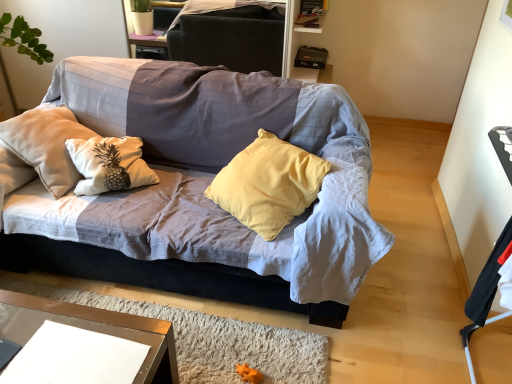
Question: Is black fabric armchair at right not close to dark gray fabric dresser at upper center?

Choices:
 (A) no
 (B) yes

Answer: (B)

Question: Is dark gray fabric dresser at upper center a part of black fabric armchair at right?

Choices:
 (A) no
 (B) yes

Answer: (A)

Question: Is black fabric armchair at right next to dark gray fabric dresser at upper center?

Choices:
 (A) no
 (B) yes

Answer: (A)

Question: From a real-world perspective, is black fabric armchair at right over dark gray fabric dresser at upper center?

Choices:
 (A) no
 (B) yes

Answer: (A)

Question: Is black fabric armchair at right wider than dark gray fabric dresser at upper center?

Choices:
 (A) yes
 (B) no

Answer: (A)

Question: Is black fabric armchair at right oriented away from dark gray fabric dresser at upper center?

Choices:
 (A) no
 (B) yes

Answer: (A)

Question: Could you tell me if textured fabric couch at center is turned towards dark gray fabric dresser at upper center?

Choices:
 (A) yes
 (B) no

Answer: (B)

Question: Is textured fabric couch at center taller than dark gray fabric dresser at upper center?

Choices:
 (A) yes
 (B) no

Answer: (A)

Question: Can you confirm if textured fabric couch at center is shorter than dark gray fabric dresser at upper center?

Choices:
 (A) no
 (B) yes

Answer: (A)

Question: Does textured fabric couch at center lie behind dark gray fabric dresser at upper center?

Choices:
 (A) yes
 (B) no

Answer: (B)

Question: Does textured fabric couch at center have a lesser width compared to dark gray fabric dresser at upper center?

Choices:
 (A) no
 (B) yes

Answer: (A)

Question: Are textured fabric couch at center and dark gray fabric dresser at upper center located far from each other?

Choices:
 (A) no
 (B) yes

Answer: (B)

Question: Is textured fabric couch at center further to camera compared to clear glass table at lower left?

Choices:
 (A) yes
 (B) no

Answer: (A)